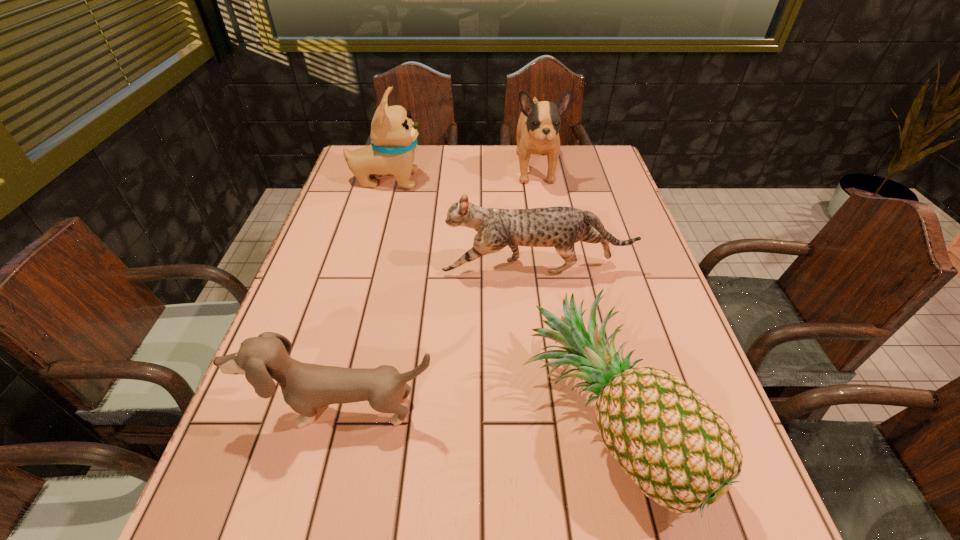
Where is `the rightmost puppy`? This screenshot has height=540, width=960. the rightmost puppy is located at coordinates (538, 127).

Locate an element on the screen. The image size is (960, 540). the third farthest object is located at coordinates (560, 227).

Find the location of a particular element. This screenshot has width=960, height=540. pineapple is located at coordinates (677, 448).

Where is `the nearest puppy`? the nearest puppy is located at coordinates (306, 387).

The image size is (960, 540). In order to click on blank space located 0.380m at the face of the rightmost puppy in this screenshot , I will do `click(555, 285)`.

At what (x,y) coordinates should I click in order to perform the action: click on free space located on the face of the third farthest object. Please return your answer as a coordinate pair (x, y). The width and height of the screenshot is (960, 540). Looking at the image, I should click on (322, 268).

At what (x,y) coordinates should I click in order to perform the action: click on free space located on the face of the third farthest object. Please return your answer as a coordinate pair (x, y). This screenshot has width=960, height=540. Looking at the image, I should click on (342, 268).

Where is `free spot located 0.210m on the face of the third farthest object`? The height and width of the screenshot is (540, 960). free spot located 0.210m on the face of the third farthest object is located at coordinates (358, 268).

Locate an element on the screen. vacant region located 0.080m on the left of the pineapple is located at coordinates (477, 420).

The width and height of the screenshot is (960, 540). Find the location of `vacant space located 0.060m at the face of the shortest puppy`. vacant space located 0.060m at the face of the shortest puppy is located at coordinates (328, 467).